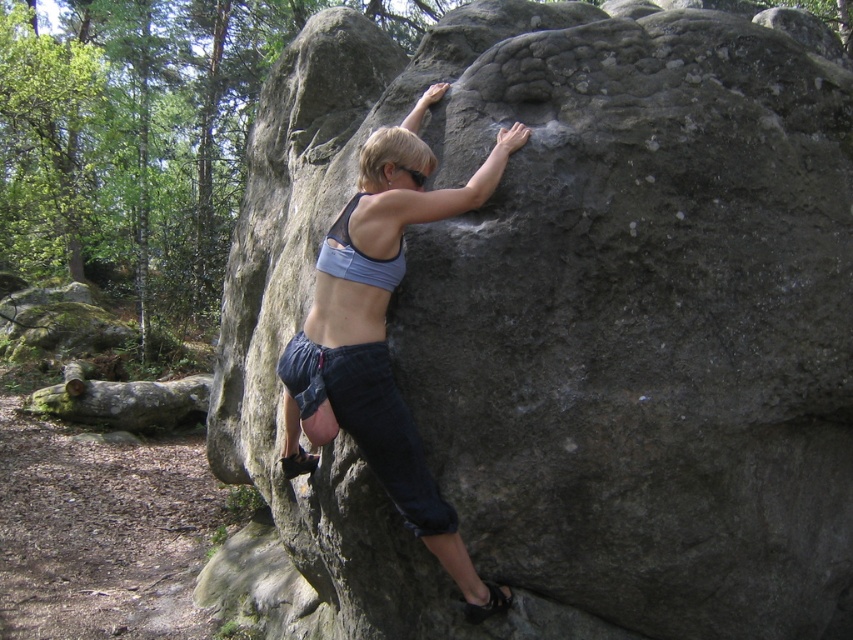
Which is above, matte gray rock climber at center or blue fabric bikini top at center?

blue fabric bikini top at center

Between matte gray rock climber at center and blue fabric bikini top at center, which one is positioned lower?

matte gray rock climber at center is lower down.

Is point (346, 356) positioned in front of point (344, 276)?

Yes, point (346, 356) is closer to viewer.

Identify the location of matte gray rock climber at center. The width and height of the screenshot is (853, 640). (384, 333).